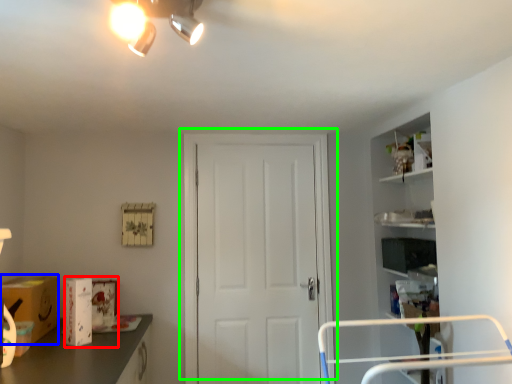
Question: Estimate the real-world distances between objects in this image. Which object is farther from box (highlighted by a red box), cardboard box (highlighted by a blue box) or door (highlighted by a green box)?

Choices:
 (A) cardboard box
 (B) door

Answer: (B)